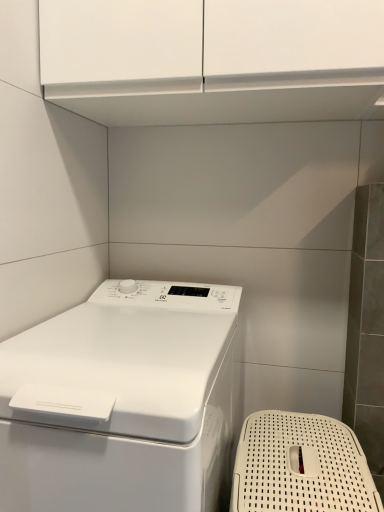
The width and height of the screenshot is (384, 512). I want to click on blank space situated above white plastic basket at lower right (from a real-world perspective), so click(303, 451).